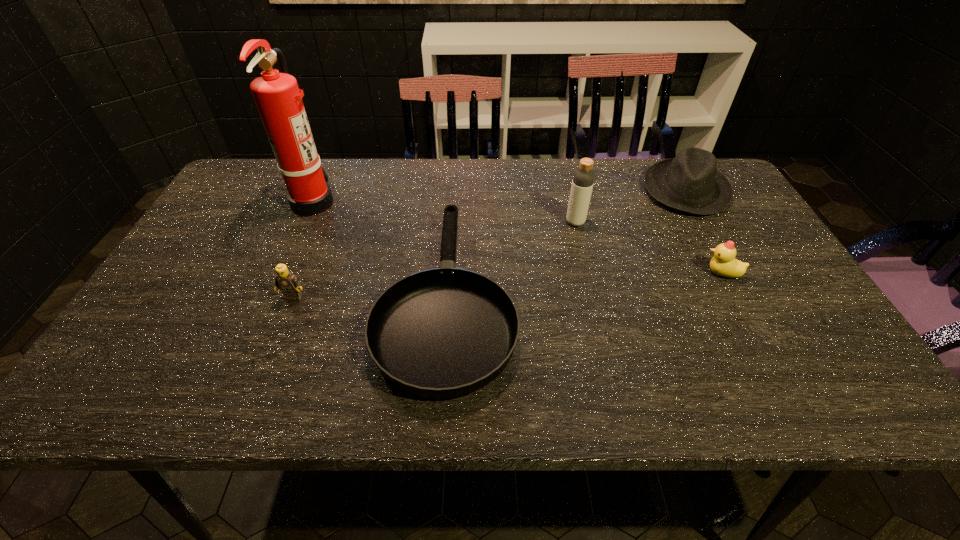
Locate an element on the screen. object that is at the near edge is located at coordinates (445, 332).

Where is `fedora at the right edge`? This screenshot has height=540, width=960. fedora at the right edge is located at coordinates (690, 182).

The width and height of the screenshot is (960, 540). I want to click on duckling present at the right edge, so click(723, 263).

Where is `object that is positioned at the far right corner`? This screenshot has width=960, height=540. object that is positioned at the far right corner is located at coordinates (690, 182).

Identify the location of free spot at the far edge of the desktop. (514, 178).

Identify the location of free spot at the near edge of the desktop. The image size is (960, 540). (544, 393).

In the image, there is a desktop. Where is `free space at the left edge`? This screenshot has height=540, width=960. free space at the left edge is located at coordinates (131, 348).

This screenshot has width=960, height=540. In the image, there is a desktop. Identify the location of blank space at the right edge. (815, 330).

Where is `unoccupied position between the duckling and the fedora`? This screenshot has height=540, width=960. unoccupied position between the duckling and the fedora is located at coordinates (704, 232).

Where is `free space that is in between the frying pan and the fedora`? free space that is in between the frying pan and the fedora is located at coordinates (566, 244).